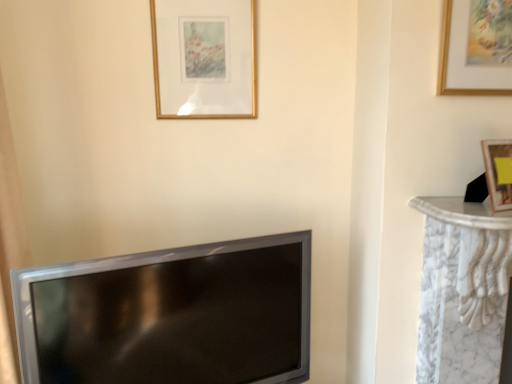
How much space does gold wooden picture frame at upper right, the first picture frame from the front, occupy vertically?

gold wooden picture frame at upper right, the first picture frame from the front, is 12.39 inches tall.

Describe the element at coordinates (205, 58) in the screenshot. This screenshot has height=384, width=512. I see `gold wooden picture frame at upper center, which ranks as the 2th picture frame in right-to-left order` at that location.

You are a GUI agent. You are given a task and a screenshot of the screen. Output one action in this format:
    pyautogui.click(x=<x>, y=<y>)
    Task: Click on the gold wooden picture frame at upper right, acting as the 1th picture frame starting from the right
    This screenshot has width=512, height=384.
    Given the screenshot: What is the action you would take?
    pyautogui.click(x=476, y=48)

Is gold wooden picture frame at upper right, the second picture frame in the left-to-right sequence, next to matte black tv at lower left?

No, gold wooden picture frame at upper right, the second picture frame in the left-to-right sequence, is not in contact with matte black tv at lower left.

Looking at this image, based on their sizes in the image, would you say gold wooden picture frame at upper right, acting as the 1th picture frame starting from the right, is bigger or smaller than matte black tv at lower left?

Clearly, gold wooden picture frame at upper right, acting as the 1th picture frame starting from the right, is smaller in size than matte black tv at lower left.

Is gold wooden picture frame at upper right, acting as the 1th picture frame starting from the right, oriented away from matte black tv at lower left?

No.

From the image's perspective, relative to matte black tv at lower left, is gold wooden picture frame at upper center, positioned as the first picture frame in back-to-front order, above or below?

gold wooden picture frame at upper center, positioned as the first picture frame in back-to-front order, is above matte black tv at lower left.

Do you think gold wooden picture frame at upper center, placed as the 2th picture frame when sorted from front to back, is within matte black tv at lower left, or outside of it?

gold wooden picture frame at upper center, placed as the 2th picture frame when sorted from front to back, is outside matte black tv at lower left.

Considering the relative sizes of gold wooden picture frame at upper center, which ranks as the 2th picture frame in right-to-left order, and matte black tv at lower left in the image provided, is gold wooden picture frame at upper center, which ranks as the 2th picture frame in right-to-left order, smaller than matte black tv at lower left?

Correct, gold wooden picture frame at upper center, which ranks as the 2th picture frame in right-to-left order, occupies less space than matte black tv at lower left.

Based on their positions, is gold wooden picture frame at upper center, which is the first picture frame from left to right, located to the left or right of gold wooden picture frame at upper right, acting as the 1th picture frame starting from the right?

gold wooden picture frame at upper center, which is the first picture frame from left to right, is to the left of gold wooden picture frame at upper right, acting as the 1th picture frame starting from the right.

From the image's perspective, which is below, gold wooden picture frame at upper center, which is the first picture frame from left to right, or gold wooden picture frame at upper right, acting as the 1th picture frame starting from the right?

gold wooden picture frame at upper right, acting as the 1th picture frame starting from the right, from the image's perspective.

Considering the sizes of gold wooden picture frame at upper center, placed as the 2th picture frame when sorted from front to back, and gold wooden picture frame at upper right, the first picture frame from the front, in the image, is gold wooden picture frame at upper center, placed as the 2th picture frame when sorted from front to back, taller or shorter than gold wooden picture frame at upper right, the first picture frame from the front,?

gold wooden picture frame at upper center, placed as the 2th picture frame when sorted from front to back, is taller than gold wooden picture frame at upper right, the first picture frame from the front.

From a real-world perspective, between gold wooden picture frame at upper center, which is the first picture frame from left to right, and gold wooden picture frame at upper right, acting as the 1th picture frame starting from the right, who is vertically lower?

gold wooden picture frame at upper right, acting as the 1th picture frame starting from the right, from a real-world perspective.

Which is less distant, (501, 73) or (199, 114)?

Point (501, 73) is positioned closer to the camera compared to point (199, 114).

Is gold wooden picture frame at upper right, acting as the 1th picture frame starting from the right, inside the boundaries of gold wooden picture frame at upper center, which is the first picture frame from left to right, or outside?

gold wooden picture frame at upper right, acting as the 1th picture frame starting from the right, cannot be found inside gold wooden picture frame at upper center, which is the first picture frame from left to right.

Is gold wooden picture frame at upper center, positioned as the first picture frame in back-to-front order, at the back of gold wooden picture frame at upper right, the second picture frame in the left-to-right sequence?

No, gold wooden picture frame at upper center, positioned as the first picture frame in back-to-front order, is not at the back of gold wooden picture frame at upper right, the second picture frame in the left-to-right sequence.

From the image's perspective, does gold wooden picture frame at upper right, which is counted as the second picture frame, starting from the back, appear higher than gold wooden picture frame at upper center, placed as the 2th picture frame when sorted from front to back?

No, from the image's perspective, gold wooden picture frame at upper right, which is counted as the second picture frame, starting from the back, is not above gold wooden picture frame at upper center, placed as the 2th picture frame when sorted from front to back.

How many degrees apart are the facing directions of matte black tv at lower left and gold wooden picture frame at upper right, the second picture frame in the left-to-right sequence?

They differ by 22.1 degrees in their facing directions.

Can you confirm if matte black tv at lower left is positioned to the right of gold wooden picture frame at upper right, the first picture frame from the front?

In fact, matte black tv at lower left is to the left of gold wooden picture frame at upper right, the first picture frame from the front.

Considering the points (127, 298) and (485, 82), which point is behind, point (127, 298) or point (485, 82)?

The point (485, 82) is farther.

Considering the relative positions of matte black tv at lower left and gold wooden picture frame at upper right, the second picture frame in the left-to-right sequence, in the image provided, is matte black tv at lower left in front of gold wooden picture frame at upper right, the second picture frame in the left-to-right sequence,?

Yes, matte black tv at lower left is closer to the viewer.

Is matte black tv at lower left looking in the opposite direction of gold wooden picture frame at upper center, which ranks as the 2th picture frame in right-to-left order?

That's not correct — matte black tv at lower left is not looking away from gold wooden picture frame at upper center, which ranks as the 2th picture frame in right-to-left order.

From a real-world perspective, between matte black tv at lower left and gold wooden picture frame at upper center, positioned as the first picture frame in back-to-front order, who is vertically higher?

In real-world perspective, gold wooden picture frame at upper center, positioned as the first picture frame in back-to-front order, is above.

Considering the positions of point (242, 343) and point (167, 11), is point (242, 343) closer or farther from the camera than point (167, 11)?

Point (242, 343) appears to be closer to the viewer than point (167, 11).

The height and width of the screenshot is (384, 512). What are the coordinates of `the 1st picture frame above the matte black tv at lower left (from the image's perspective)` in the screenshot? It's located at (476, 48).

You are a GUI agent. You are given a task and a screenshot of the screen. Output one action in this format:
    pyautogui.click(x=<x>, y=<y>)
    Task: Click on the picture frame that is the 2nd object located behind the matte black tv at lower left
    Image resolution: width=512 pixels, height=384 pixels.
    Given the screenshot: What is the action you would take?
    pyautogui.click(x=205, y=58)

Which object lies nearer to the anchor point gold wooden picture frame at upper center, placed as the 2th picture frame when sorted from front to back, matte black tv at lower left or gold wooden picture frame at upper right, the second picture frame in the left-to-right sequence?

Among the two, matte black tv at lower left is located nearer to gold wooden picture frame at upper center, placed as the 2th picture frame when sorted from front to back.

Looking at the image, which one is located further to matte black tv at lower left, gold wooden picture frame at upper right, which is counted as the second picture frame, starting from the back, or gold wooden picture frame at upper center, positioned as the first picture frame in back-to-front order?

gold wooden picture frame at upper right, which is counted as the second picture frame, starting from the back.

Estimate the real-world distances between objects in this image. Which object is further from gold wooden picture frame at upper right, acting as the 1th picture frame starting from the right, gold wooden picture frame at upper center, placed as the 2th picture frame when sorted from front to back, or matte black tv at lower left?

Based on the image, matte black tv at lower left appears to be further to gold wooden picture frame at upper right, acting as the 1th picture frame starting from the right.

From the image, which object appears to be farther from gold wooden picture frame at upper center, placed as the 2th picture frame when sorted from front to back, gold wooden picture frame at upper right, the second picture frame in the left-to-right sequence, or matte black tv at lower left?

gold wooden picture frame at upper right, the second picture frame in the left-to-right sequence, is positioned further to the anchor gold wooden picture frame at upper center, placed as the 2th picture frame when sorted from front to back.

Based on their spatial positions, is matte black tv at lower left or gold wooden picture frame at upper center, placed as the 2th picture frame when sorted from front to back, closer to gold wooden picture frame at upper right, acting as the 1th picture frame starting from the right?

The object closer to gold wooden picture frame at upper right, acting as the 1th picture frame starting from the right, is gold wooden picture frame at upper center, placed as the 2th picture frame when sorted from front to back.

Based on the photo, estimate the real-world distances between objects in this image. Which object is further from matte black tv at lower left, gold wooden picture frame at upper center, placed as the 2th picture frame when sorted from front to back, or gold wooden picture frame at upper right, the first picture frame from the front?

The object further to matte black tv at lower left is gold wooden picture frame at upper right, the first picture frame from the front.

In order to click on picture frame between gold wooden picture frame at upper center, which is the first picture frame from left to right, and matte black tv at lower left from top to bottom in this screenshot , I will do `click(476, 48)`.